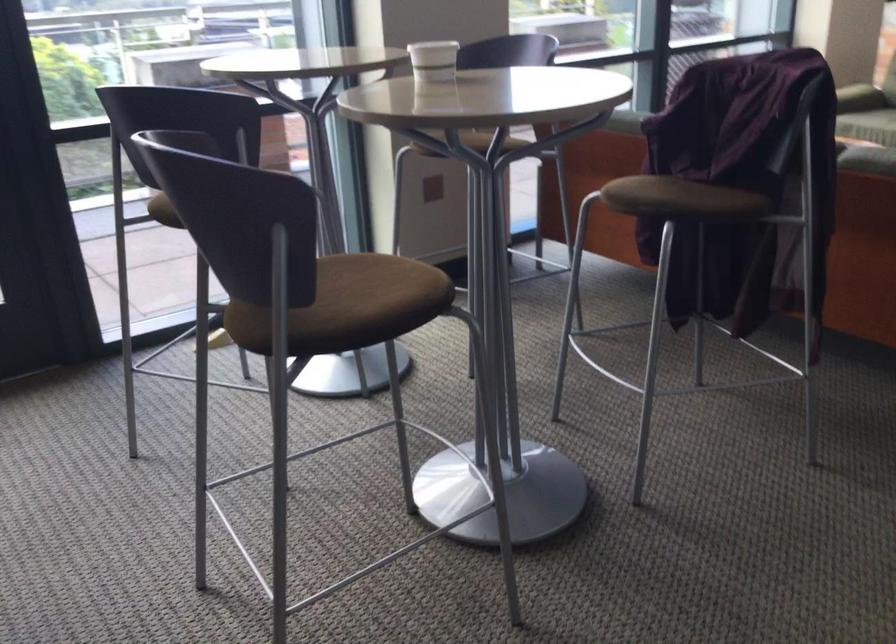
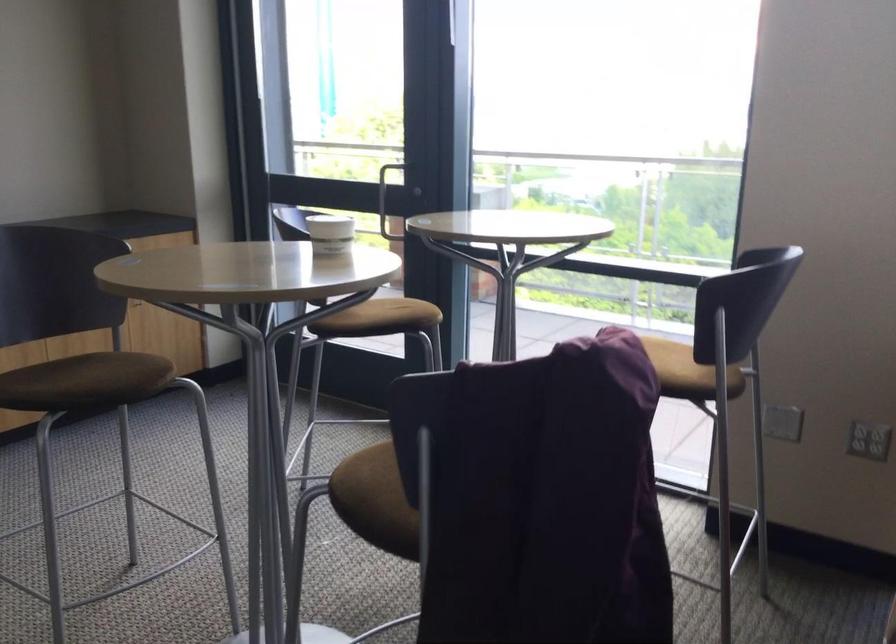
Where in the second image is the point corresponding to point 701,200 from the first image?

(369, 500)